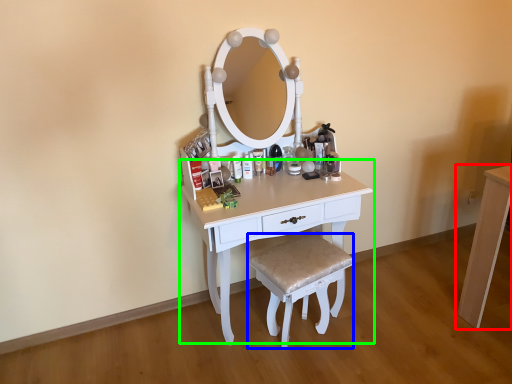
Question: Estimate the real-world distances between objects in this image. Which object is closer to table (highlighted by a red box), stool (highlighted by a blue box) or table (highlighted by a green box)?

Choices:
 (A) stool
 (B) table

Answer: (A)